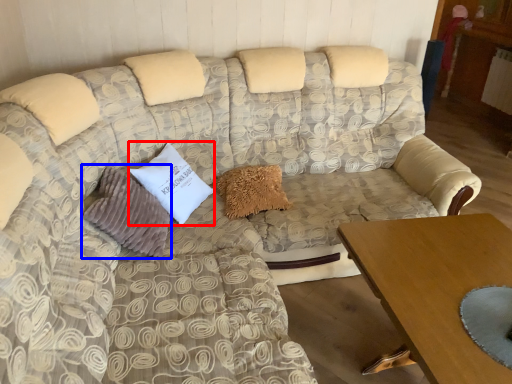
Question: Among these objects, which one is nearest to the camera, pillow (highlighted by a red box) or pillow (highlighted by a blue box)?

Choices:
 (A) pillow
 (B) pillow

Answer: (B)